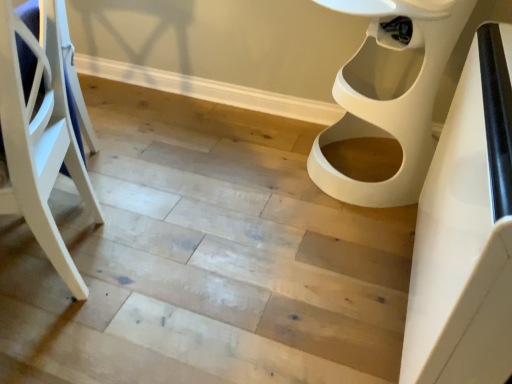
Question: From a real-world perspective, is white plastic toilet at right physically located above or below white glossy table at right?

Choices:
 (A) below
 (B) above

Answer: (A)

Question: Is white plastic toilet at right inside or outside of white glossy table at right?

Choices:
 (A) inside
 (B) outside

Answer: (B)

Question: Based on their relative distances, which object is farther from the white wood chair at left?

Choices:
 (A) white glossy table at right
 (B) white plastic toilet at right

Answer: (B)

Question: Which object is positioned closest to the white wood chair at left?

Choices:
 (A) white glossy table at right
 (B) white plastic toilet at right

Answer: (A)